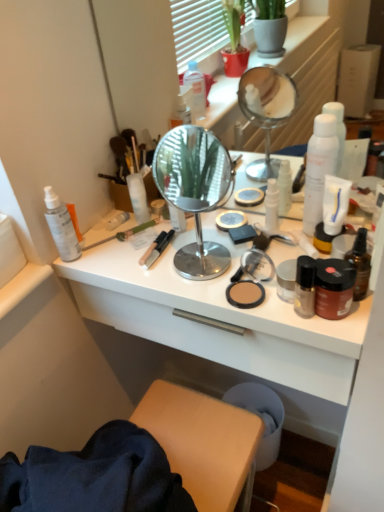
Locate an element on the screen. This screenshot has height=512, width=384. vacant space behind polished chrome mirror at center is located at coordinates (191, 229).